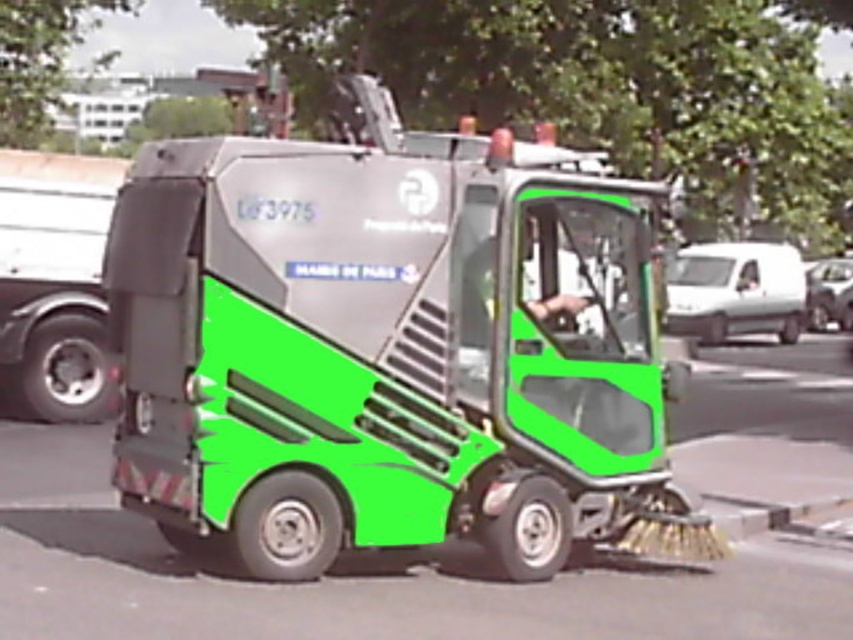
Between point (444, 289) and point (85, 224), which one is positioned behind?

The point (85, 224) is more distant.

How far apart are metallic gray garbage truck at center and metallic silver truck at left?

6.47 meters

Is point (189, 292) less distant than point (42, 230)?

Yes, point (189, 292) is in front of point (42, 230).

Locate an element on the screen. metallic gray garbage truck at center is located at coordinates (387, 353).

Can you confirm if metallic gray garbage truck at center is positioned below smooth skin hand at center?

Yes.

Find the location of a particular element. This screenshot has width=853, height=640. metallic gray garbage truck at center is located at coordinates (387, 353).

Does metallic silver truck at left appear on the right side of smooth skin hand at center?

No, metallic silver truck at left is not to the right of smooth skin hand at center.

Does metallic silver truck at left have a larger size compared to smooth skin hand at center?

Indeed, metallic silver truck at left has a larger size compared to smooth skin hand at center.

Between point (12, 378) and point (538, 282), which one is positioned behind?

Positioned behind is point (12, 378).

The image size is (853, 640). I want to click on metallic silver truck at left, so click(54, 282).